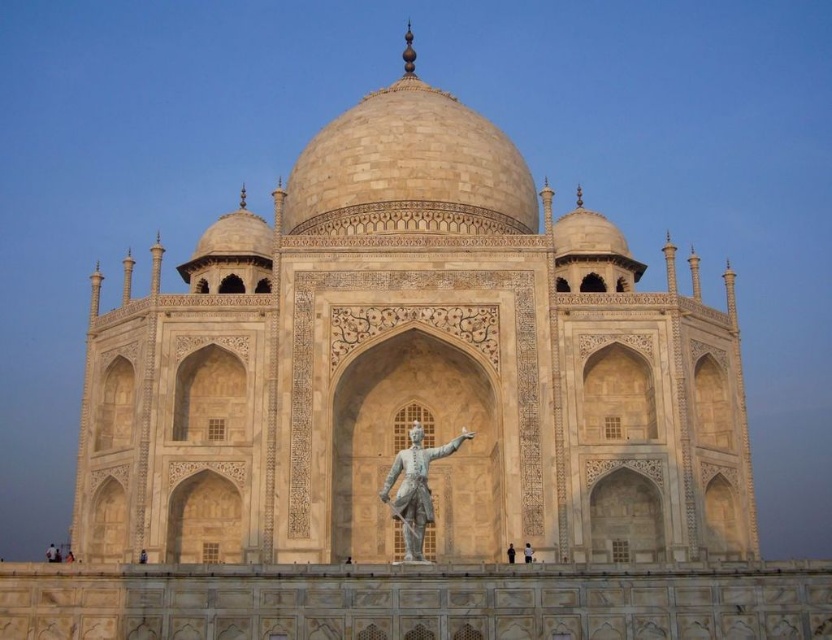
From the picture: Is polished bronze statue at center bigger than black statue at center?

Indeed, polished bronze statue at center has a larger size compared to black statue at center.

Is polished bronze statue at center below black statue at center?

No.

Does point (405, 454) come closer to viewer compared to point (508, 556)?

Yes, point (405, 454) is closer to viewer.

Find the location of a particular element. This screenshot has width=832, height=640. polished bronze statue at center is located at coordinates (416, 486).

Does smooth white statue at center appear on the left side of black statue at center?

No, smooth white statue at center is not to the left of black statue at center.

Does point (525, 556) come in front of point (509, 545)?

Yes.

Is point (525, 548) closer to viewer compared to point (511, 552)?

Yes, point (525, 548) is in front of point (511, 552).

Where is `smooth white statue at center`? The image size is (832, 640). smooth white statue at center is located at coordinates (527, 552).

Is beige stone taj mahal at center closer to camera compared to smooth white statue at center?

No, beige stone taj mahal at center is further to the viewer.

Is beige stone taj mahal at center taller than smooth white statue at center?

Correct, beige stone taj mahal at center is much taller as smooth white statue at center.

What do you see at coordinates (412, 369) in the screenshot? The image size is (832, 640). I see `beige stone taj mahal at center` at bounding box center [412, 369].

Where is `beige stone taj mahal at center`? Image resolution: width=832 pixels, height=640 pixels. beige stone taj mahal at center is located at coordinates (412, 369).